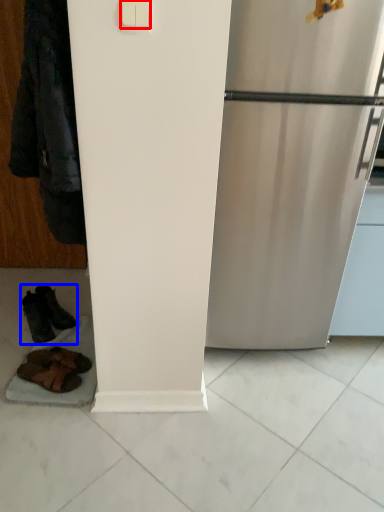
Question: Which of the following is the closest to the observer, light switch (highlighted by a red box) or footwear (highlighted by a blue box)?

Choices:
 (A) light switch
 (B) footwear

Answer: (A)